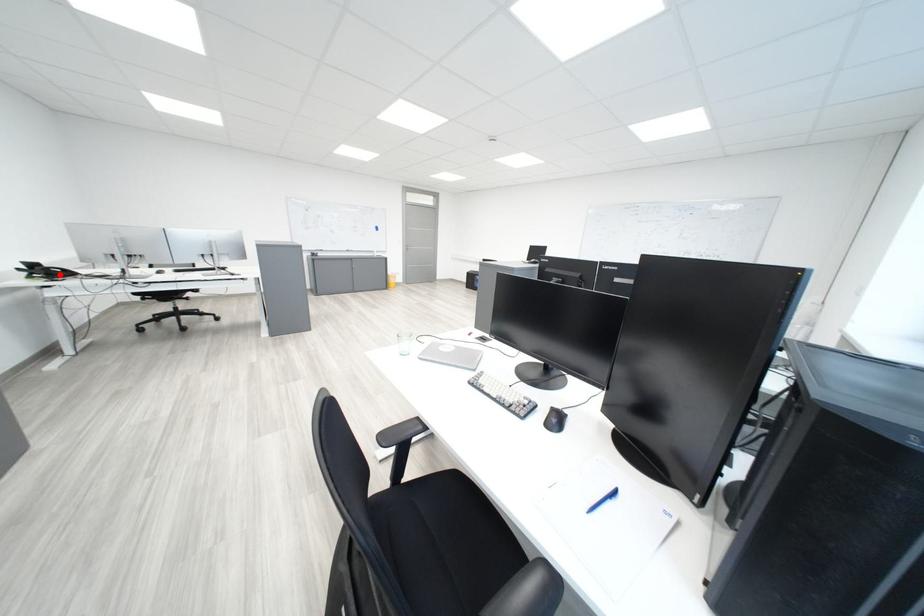
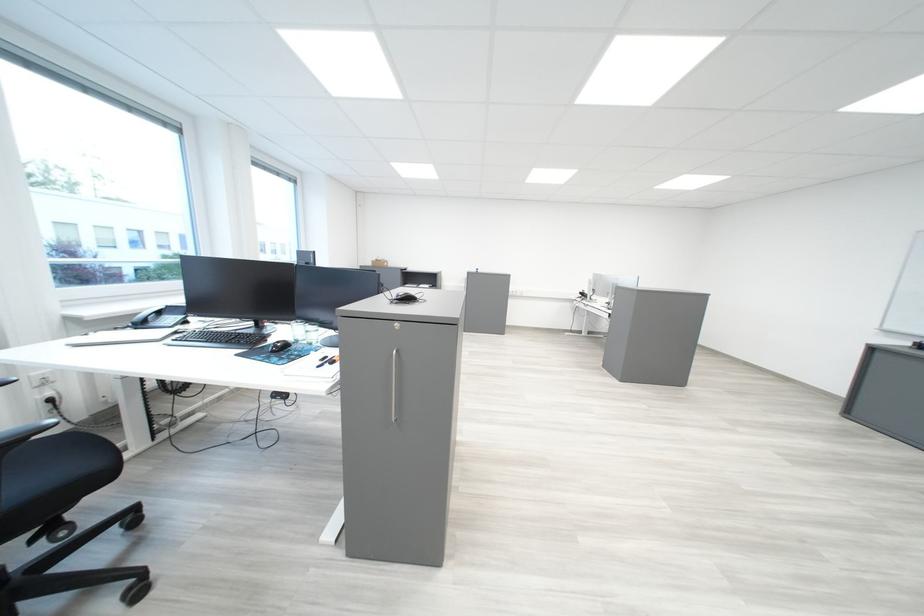
Question: I am providing you with two images of the same scene from different viewpoints. A red point is marked on the first image. At the location where the point appears in image 1, is it still visible in image 2?

Choices:
 (A) Yes
 (B) No

Answer: (B)